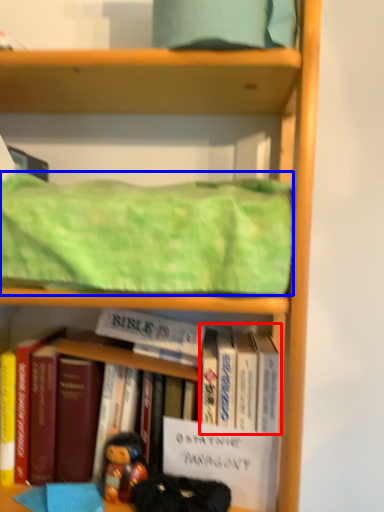
Question: Which of the following is the farthest to the observer, book (highlighted by a red box) or blanket (highlighted by a blue box)?

Choices:
 (A) book
 (B) blanket

Answer: (A)